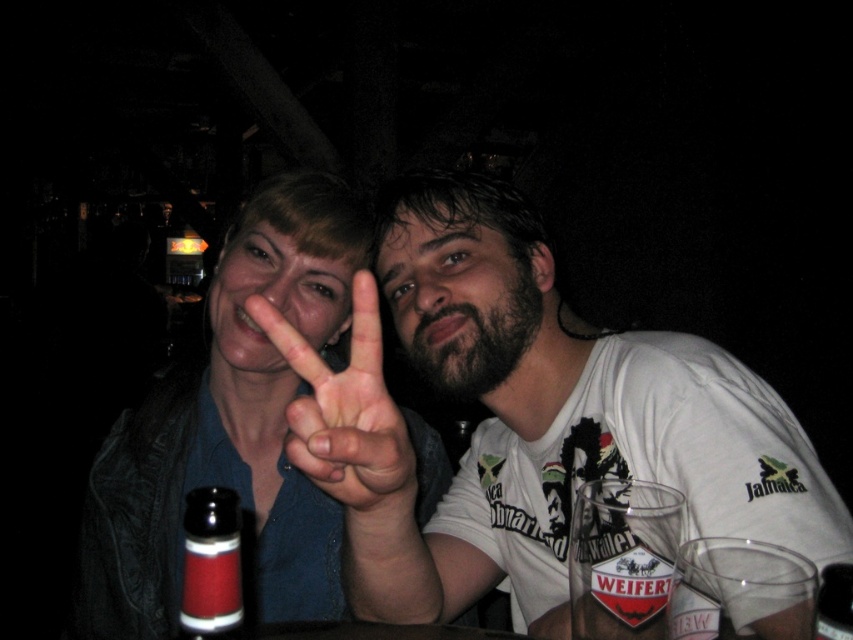
Is white cotton t-shirt at center positioned behind red glass bottle at center?

Yes, white cotton t-shirt at center is further from the viewer.

Can you confirm if white cotton t-shirt at center is thinner than red glass bottle at center?

In fact, white cotton t-shirt at center might be wider than red glass bottle at center.

Is point (762, 481) farther from viewer compared to point (193, 632)?

Yes, it is.

Image resolution: width=853 pixels, height=640 pixels. In order to click on white cotton t-shirt at center in this screenshot , I will do `click(527, 419)`.

Between white cotton t-shirt at center and matte skin hand at center, which one has less height?

matte skin hand at center is shorter.

Which is behind, point (525, 260) or point (271, 337)?

Positioned behind is point (525, 260).

Is point (593, 401) farther from viewer compared to point (376, 300)?

Yes.

The image size is (853, 640). I want to click on white cotton t-shirt at center, so click(x=527, y=419).

Which of these two, matte skin hand at center or red glass bottle at center, stands taller?

matte skin hand at center

At what (x,y) coordinates should I click in order to perform the action: click on matte skin hand at center. Please return your answer as a coordinate pair (x, y). Looking at the image, I should click on (346, 412).